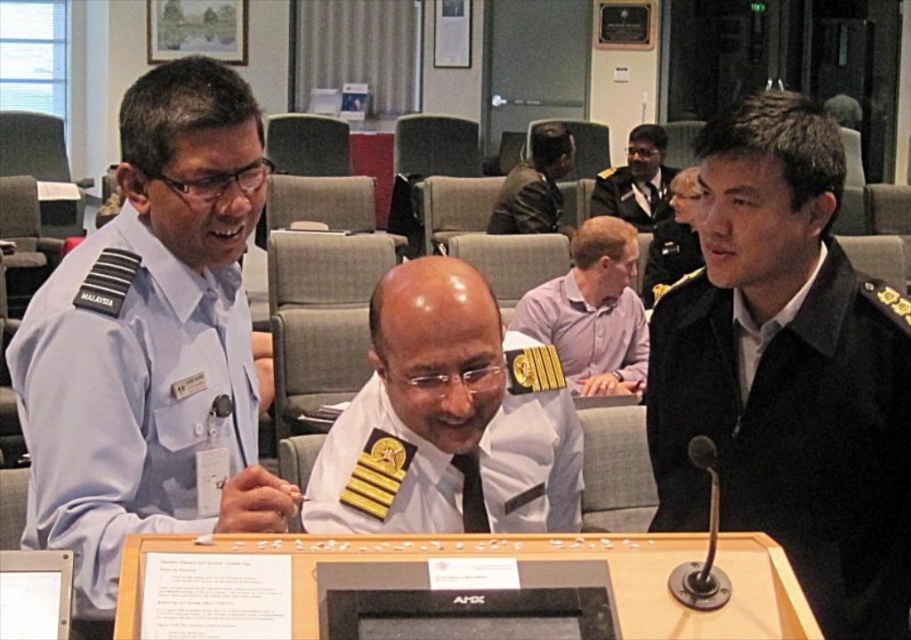
Question: Which object is farther from the camera taking this photo?

Choices:
 (A) black uniform at center
 (B) black uniform at right
 (C) black matte jacket at right

Answer: (A)

Question: Among these objects, which one is nearest to the camera?

Choices:
 (A) white uniform at center
 (B) light blue fabric uniform at left

Answer: (B)

Question: Which object is the closest to the wooden table at center?

Choices:
 (A) black uniform at right
 (B) pink shirt at center
 (C) white uniform at center
 (D) black matte jacket at right

Answer: (C)

Question: Is the position of black matte jacket at right less distant than that of black uniform at center?

Choices:
 (A) yes
 (B) no

Answer: (A)

Question: Does pink shirt at center have a greater width compared to black uniform at right?

Choices:
 (A) yes
 (B) no

Answer: (A)

Question: Is white uniform at center further to camera compared to black uniform at center?

Choices:
 (A) yes
 (B) no

Answer: (B)